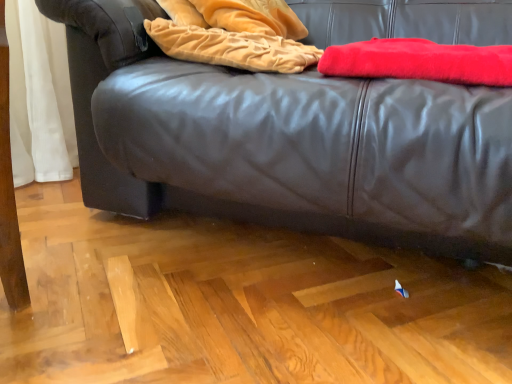
The image size is (512, 384). Find the location of `velvet gold blanket at upper center, which appears as the 1th blanket when viewed from the left`. velvet gold blanket at upper center, which appears as the 1th blanket when viewed from the left is located at coordinates (233, 34).

I want to click on black leather couch at center, so click(x=285, y=142).

This screenshot has height=384, width=512. Identify the location of velvet gold blanket at upper center, which appears as the 1th blanket when viewed from the left. (233, 34).

In terms of size, does black leather couch at center appear bigger or smaller than velvet gold blanket at upper center, which appears as the 1th blanket when viewed from the left?

Considering their sizes, black leather couch at center takes up more space than velvet gold blanket at upper center, which appears as the 1th blanket when viewed from the left.

From a real-world perspective, is black leather couch at center positioned above or below velvet gold blanket at upper center, which appears as the 1th blanket when viewed from the left?

black leather couch at center is situated lower than velvet gold blanket at upper center, which appears as the 1th blanket when viewed from the left, in the real world.

Would you say black leather couch at center is inside or outside velvet gold blanket at upper center, which is the second blanket in right-to-left order?

black leather couch at center cannot be found inside velvet gold blanket at upper center, which is the second blanket in right-to-left order.

Is point (130, 106) closer to camera compared to point (193, 6)?

Yes, point (130, 106) is closer to viewer.

Considering the relative sizes of velvet gold blanket at upper center, which appears as the 1th blanket when viewed from the left, and black leather couch at center in the image provided, is velvet gold blanket at upper center, which appears as the 1th blanket when viewed from the left, wider than black leather couch at center?

Incorrect, the width of velvet gold blanket at upper center, which appears as the 1th blanket when viewed from the left, does not surpass that of black leather couch at center.

From a real-world perspective, who is located lower, velvet gold blanket at upper center, which is the second blanket in right-to-left order, or black leather couch at center?

black leather couch at center, from a real-world perspective.

The image size is (512, 384). Identify the location of the 2nd blanket above the black leather couch at center (from the image's perspective). (233, 34).

Is velvet gold blanket at upper center, which is the second blanket in right-to-left order, oriented away from black leather couch at center?

Yes, velvet gold blanket at upper center, which is the second blanket in right-to-left order,'s orientation is away from black leather couch at center.

Consider the image. Is black leather couch at center wider or thinner than red fuzzy blanket at upper right, the 2th blanket when ordered from left to right?

Clearly, black leather couch at center has more width compared to red fuzzy blanket at upper right, the 2th blanket when ordered from left to right.

Considering the sizes of black leather couch at center and red fuzzy blanket at upper right, the 2th blanket when ordered from left to right, in the image, is black leather couch at center bigger or smaller than red fuzzy blanket at upper right, the 2th blanket when ordered from left to right,?

In the image, black leather couch at center appears to be larger than red fuzzy blanket at upper right, the 2th blanket when ordered from left to right.

Considering the sizes of objects black leather couch at center and red fuzzy blanket at upper right, the 2th blanket when ordered from left to right, in the image provided, who is shorter, black leather couch at center or red fuzzy blanket at upper right, the 2th blanket when ordered from left to right,?

Standing shorter between the two is red fuzzy blanket at upper right, the 2th blanket when ordered from left to right.

How much distance is there between black leather couch at center and red fuzzy blanket at upper right, the 1th blanket from the right?

black leather couch at center and red fuzzy blanket at upper right, the 1th blanket from the right, are 23.39 centimeters apart from each other.

Looking at this image, is velvet gold blanket at upper center, which appears as the 1th blanket when viewed from the left, bigger than red fuzzy blanket at upper right, the 2th blanket when ordered from left to right?

Actually, velvet gold blanket at upper center, which appears as the 1th blanket when viewed from the left, might be smaller than red fuzzy blanket at upper right, the 2th blanket when ordered from left to right.

Are velvet gold blanket at upper center, which appears as the 1th blanket when viewed from the left, and red fuzzy blanket at upper right, the 2th blanket when ordered from left to right, far apart?

No, there isn't a large distance between velvet gold blanket at upper center, which appears as the 1th blanket when viewed from the left, and red fuzzy blanket at upper right, the 2th blanket when ordered from left to right.

Considering the points (409, 55) and (240, 61), which point is behind, point (409, 55) or point (240, 61)?

The point (240, 61) is behind.

From the image's perspective, relative to velvet gold blanket at upper center, which appears as the 1th blanket when viewed from the left, is red fuzzy blanket at upper right, the 1th blanket from the right, above or below?

red fuzzy blanket at upper right, the 1th blanket from the right, is situated lower than velvet gold blanket at upper center, which appears as the 1th blanket when viewed from the left, in the image.

Which is more to the right, red fuzzy blanket at upper right, the 2th blanket when ordered from left to right, or velvet gold blanket at upper center, which is the second blanket in right-to-left order?

red fuzzy blanket at upper right, the 2th blanket when ordered from left to right.

From a real-world perspective, who is located higher, red fuzzy blanket at upper right, the 2th blanket when ordered from left to right, or velvet gold blanket at upper center, which appears as the 1th blanket when viewed from the left?

From a 3D spatial view, velvet gold blanket at upper center, which appears as the 1th blanket when viewed from the left, is above.

Is red fuzzy blanket at upper right, the 1th blanket from the right, positioned beyond the bounds of black leather couch at center?

No.

Is red fuzzy blanket at upper right, the 1th blanket from the right, next to black leather couch at center?

No, red fuzzy blanket at upper right, the 1th blanket from the right, is not next to black leather couch at center.

What's the angular difference between red fuzzy blanket at upper right, the 1th blanket from the right, and black leather couch at center's facing directions?

red fuzzy blanket at upper right, the 1th blanket from the right, and black leather couch at center are facing 2.83 degrees away from each other.

At what (x,y) coordinates should I click in order to perform the action: click on the 2nd blanket behind the black leather couch at center, counting from the anchor's position. Please return your answer as a coordinate pair (x, y). The height and width of the screenshot is (384, 512). Looking at the image, I should click on (233, 34).

Find the location of a particular element. This screenshot has width=512, height=384. studio couch in front of the velvet gold blanket at upper center, which appears as the 1th blanket when viewed from the left is located at coordinates (285, 142).

When comparing their distances from black leather couch at center, does velvet gold blanket at upper center, which is the second blanket in right-to-left order, or red fuzzy blanket at upper right, the 1th blanket from the right, seem further?

red fuzzy blanket at upper right, the 1th blanket from the right, is further to black leather couch at center.

When comparing their distances from velvet gold blanket at upper center, which appears as the 1th blanket when viewed from the left, does black leather couch at center or red fuzzy blanket at upper right, the 2th blanket when ordered from left to right, seem closer?

black leather couch at center is closer to velvet gold blanket at upper center, which appears as the 1th blanket when viewed from the left.

Looking at the image, which one is located closer to black leather couch at center, red fuzzy blanket at upper right, the 1th blanket from the right, or velvet gold blanket at upper center, which is the second blanket in right-to-left order?

velvet gold blanket at upper center, which is the second blanket in right-to-left order, is positioned closer to the anchor black leather couch at center.

Estimate the real-world distances between objects in this image. Which object is closer to red fuzzy blanket at upper right, the 2th blanket when ordered from left to right, black leather couch at center or velvet gold blanket at upper center, which appears as the 1th blanket when viewed from the left?

The object closer to red fuzzy blanket at upper right, the 2th blanket when ordered from left to right, is velvet gold blanket at upper center, which appears as the 1th blanket when viewed from the left.

Which object lies further to the anchor point red fuzzy blanket at upper right, the 1th blanket from the right, velvet gold blanket at upper center, which appears as the 1th blanket when viewed from the left, or black leather couch at center?

The object further to red fuzzy blanket at upper right, the 1th blanket from the right, is black leather couch at center.

Looking at the image, which one is located closer to velvet gold blanket at upper center, which appears as the 1th blanket when viewed from the left, red fuzzy blanket at upper right, the 1th blanket from the right, or black leather couch at center?

black leather couch at center lies closer to velvet gold blanket at upper center, which appears as the 1th blanket when viewed from the left, than the other object.

Where is `studio couch situated between velvet gold blanket at upper center, which appears as the 1th blanket when viewed from the left, and red fuzzy blanket at upper right, the 2th blanket when ordered from left to right, from left to right`? This screenshot has width=512, height=384. studio couch situated between velvet gold blanket at upper center, which appears as the 1th blanket when viewed from the left, and red fuzzy blanket at upper right, the 2th blanket when ordered from left to right, from left to right is located at coordinates (285, 142).